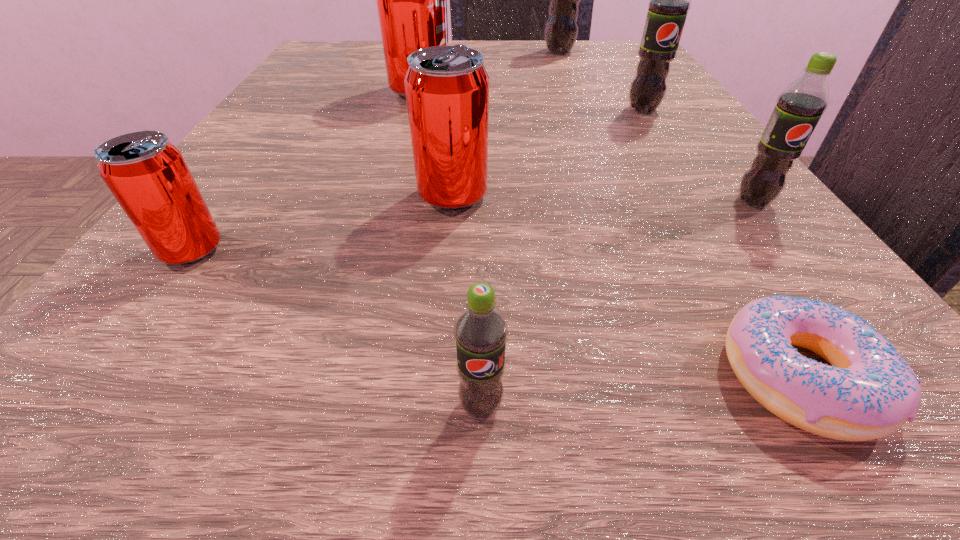
You are a GUI agent. You are given a task and a screenshot of the screen. Output one action in this format:
    pyautogui.click(x=<x>, y=<y>)
    Task: Click on the leftmost green soda
    This screenshot has width=960, height=540.
    Given the screenshot: What is the action you would take?
    pyautogui.click(x=480, y=330)

Where is `the nearest soda`? the nearest soda is located at coordinates click(480, 330).

At what (x,y) coordinates should I click in order to perform the action: click on doughnut. Please return your answer as a coordinate pair (x, y). This screenshot has height=540, width=960. Looking at the image, I should click on (869, 392).

The height and width of the screenshot is (540, 960). I want to click on pink doughnut, so click(869, 392).

Where is `vacant space located on the front label of the tallest object`? The image size is (960, 540). vacant space located on the front label of the tallest object is located at coordinates (604, 165).

Locate an element on the screen. free region located 0.050m on the left of the biggest red soda can is located at coordinates click(x=359, y=91).

Image resolution: width=960 pixels, height=540 pixels. In order to click on free spot located 0.130m on the front label of the second biggest green soda in this screenshot , I will do `click(676, 162)`.

Locate an element on the screen. The image size is (960, 540). vacant space situated 0.220m on the front label of the rightmost green soda is located at coordinates (900, 391).

Find the location of a particular element. free location located on the back of the second nearest red soda can is located at coordinates (462, 85).

Find the location of a particular element. The image size is (960, 540). vacant area located 0.100m on the front of the leftmost object is located at coordinates click(x=112, y=359).